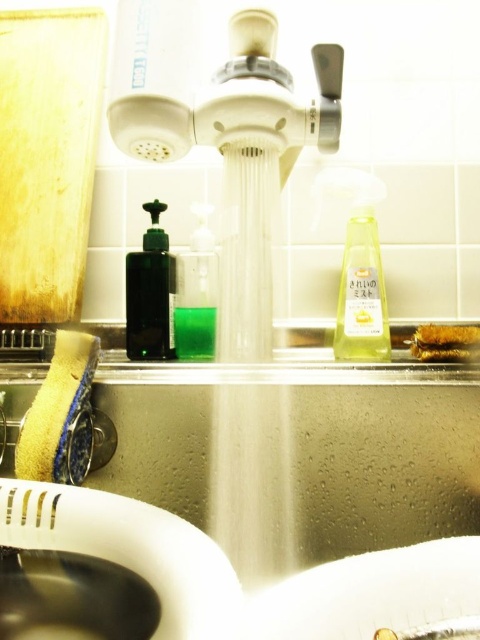
Does white glossy sink at lower left appear on the right side of green translucent bottle at center?

No, white glossy sink at lower left is not to the right of green translucent bottle at center.

Is white glossy sink at lower left above green translucent bottle at center?

Incorrect, white glossy sink at lower left is not positioned above green translucent bottle at center.

Where is `white glossy sink at lower left`? white glossy sink at lower left is located at coordinates (108, 570).

Does metallic stainless steel sink at center have a lesser height compared to white glossy sink at lower left?

Incorrect, metallic stainless steel sink at center's height does not fall short of white glossy sink at lower left's.

Who is lower down, metallic stainless steel sink at center or white glossy sink at lower left?

white glossy sink at lower left is below.

Who is more forward, (456, 600) or (96, 602)?

Point (456, 600) is in front.

Where is `metallic stainless steel sink at center`? The image size is (480, 640). metallic stainless steel sink at center is located at coordinates (215, 556).

Is metallic stainless steel sink at center above green translucent bottle at center?

No, metallic stainless steel sink at center is not above green translucent bottle at center.

Who is more distant from viewer, (106, 577) or (180, 353)?

The point (180, 353) is more distant.

Describe the element at coordinates (215, 556) in the screenshot. I see `metallic stainless steel sink at center` at that location.

What are the coordinates of `metallic stainless steel sink at center` in the screenshot? It's located at (215, 556).